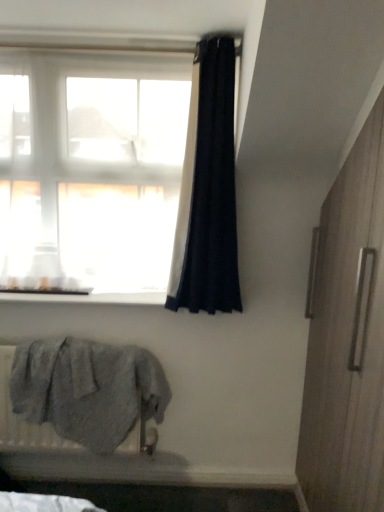
Where is `white smooth window sill at lower left`? white smooth window sill at lower left is located at coordinates (89, 298).

You are a GUI agent. You are given a task and a screenshot of the screen. Output one action in this format:
    pyautogui.click(x=<x>, y=<y>)
    Task: Click on the gray fluffy towel at lower left
    Image resolution: width=384 pixels, height=512 pixels.
    Given the screenshot: What is the action you would take?
    pyautogui.click(x=23, y=421)

I want to click on white smooth window sill at lower left, so click(x=89, y=298).

Is white smooth window sill at lower left situated inside gray fluffy towel at lower left or outside?

white smooth window sill at lower left is not inside gray fluffy towel at lower left, it's outside.

Considering the sizes of white smooth window sill at lower left and gray fluffy towel at lower left in the image, is white smooth window sill at lower left wider or thinner than gray fluffy towel at lower left?

In the image, white smooth window sill at lower left appears to be wider than gray fluffy towel at lower left.

Between white smooth window sill at lower left and gray fluffy towel at lower left, which one has more height?

gray fluffy towel at lower left is taller.

From the image's perspective, which one is positioned lower, gray fluffy towel at lower left or wooden screen door at right?

gray fluffy towel at lower left, from the image's perspective.

Considering the relative sizes of gray fluffy towel at lower left and wooden screen door at right in the image provided, is gray fluffy towel at lower left smaller than wooden screen door at right?

Yes.

Considering the points (126, 443) and (340, 463), which point is in front, point (126, 443) or point (340, 463)?

The point (340, 463) is closer to the camera.

Is white smooth window sill at lower left far away from black fabric curtain at upper center?

They are positioned close to each other.

How different are the orientations of white smooth window sill at lower left and black fabric curtain at upper center in degrees?

0.00253 degrees.

Where is `curtain in front of the white smooth window sill at lower left`? curtain in front of the white smooth window sill at lower left is located at coordinates (208, 190).

Does white smooth window sill at lower left have a greater width compared to black fabric curtain at upper center?

Correct, the width of white smooth window sill at lower left exceeds that of black fabric curtain at upper center.

Is translucent white curtain at upper left not inside wooden screen door at right?

Yes, translucent white curtain at upper left is located beyond the bounds of wooden screen door at right.

Considering the sizes of translucent white curtain at upper left and wooden screen door at right in the image, is translucent white curtain at upper left bigger or smaller than wooden screen door at right?

Considering their sizes, translucent white curtain at upper left takes up less space than wooden screen door at right.

From the image's perspective, between translucent white curtain at upper left and wooden screen door at right, which one is located above?

translucent white curtain at upper left, from the image's perspective.

Is the position of translucent white curtain at upper left less distant than that of wooden screen door at right?

No, translucent white curtain at upper left is further to the viewer.

The height and width of the screenshot is (512, 384). What are the coordinates of `radiator lying behind the translucent white curtain at upper left` in the screenshot? It's located at (23, 421).

Considering the relative sizes of gray fluffy towel at lower left and translucent white curtain at upper left in the image provided, is gray fluffy towel at lower left thinner than translucent white curtain at upper left?

Yes, gray fluffy towel at lower left is thinner than translucent white curtain at upper left.

Is gray fluffy towel at lower left taller or shorter than translucent white curtain at upper left?

Clearly, gray fluffy towel at lower left is shorter compared to translucent white curtain at upper left.

Considering the positions of objects gray fluffy towel at lower left and translucent white curtain at upper left in the image provided, who is more to the right, gray fluffy towel at lower left or translucent white curtain at upper left?

From the viewer's perspective, translucent white curtain at upper left appears more on the right side.

The image size is (384, 512). I want to click on curtain in front of the white smooth window sill at lower left, so click(208, 190).

Could you tell me if black fabric curtain at upper center is facing white smooth window sill at lower left?

No, black fabric curtain at upper center is not aimed at white smooth window sill at lower left.

Which object is positioned more to the left, black fabric curtain at upper center or white smooth window sill at lower left?

Positioned to the left is white smooth window sill at lower left.

Considering the positions of objects translucent white curtain at upper left and gray fluffy towel at lower left in the image provided, who is behind, translucent white curtain at upper left or gray fluffy towel at lower left?

gray fluffy towel at lower left is further away from the camera.

Can you tell me how much translucent white curtain at upper left and gray fluffy towel at lower left differ in facing direction?

There is a 0.0623-degree angle between the facing directions of translucent white curtain at upper left and gray fluffy towel at lower left.

Can you confirm if translucent white curtain at upper left is smaller than gray fluffy towel at lower left?

Actually, translucent white curtain at upper left might be larger than gray fluffy towel at lower left.

Does point (170, 185) appear closer or farther from the camera than point (43, 438)?

Point (170, 185) is positioned farther from the camera compared to point (43, 438).

In the image, there is a white smooth window sill at lower left. At what (x,y) coordinates should I click in order to perform the action: click on radiator below it (from a real-world perspective). Please return your answer as a coordinate pair (x, y). This screenshot has width=384, height=512. Looking at the image, I should click on (23, 421).

In the image, there is a gray fluffy towel at lower left. In order to click on screen door above it (from the image's perspective) in this screenshot , I will do `click(347, 339)`.

Considering their positions, is translucent white curtain at upper left positioned closer to wooden screen door at right than gray fluffy towel at lower left?

translucent white curtain at upper left lies closer to wooden screen door at right than the other object.

Based on the photo, considering their positions, is black fabric curtain at upper center positioned closer to white smooth window sill at lower left than wooden screen door at right?

The object closer to white smooth window sill at lower left is black fabric curtain at upper center.

From the image, which object appears to be nearer to white smooth window sill at lower left, translucent white curtain at upper left or black fabric curtain at upper center?

The object closer to white smooth window sill at lower left is translucent white curtain at upper left.

Based on their spatial positions, is black fabric curtain at upper center or white smooth window sill at lower left closer to gray fluffy towel at lower left?

Among the two, white smooth window sill at lower left is located nearer to gray fluffy towel at lower left.

Based on their spatial positions, is gray fluffy towel at lower left or translucent white curtain at upper left closer to wooden screen door at right?

translucent white curtain at upper left is positioned closer to the anchor wooden screen door at right.

When comparing their distances from wooden screen door at right, does white smooth window sill at lower left or translucent white curtain at upper left seem closer?

Among the two, white smooth window sill at lower left is located nearer to wooden screen door at right.

Looking at the image, which one is located closer to white smooth window sill at lower left, black fabric curtain at upper center or gray fluffy towel at lower left?

Among the two, black fabric curtain at upper center is located nearer to white smooth window sill at lower left.

Based on their spatial positions, is gray fluffy towel at lower left or wooden screen door at right closer to translucent white curtain at upper left?

Based on the image, gray fluffy towel at lower left appears to be nearer to translucent white curtain at upper left.

I want to click on window sill between translucent white curtain at upper left and gray fluffy towel at lower left vertically, so click(x=89, y=298).

Locate an element on the screen. This screenshot has width=384, height=512. window situated between gray fluffy towel at lower left and wooden screen door at right from left to right is located at coordinates (91, 172).

Identify the location of curtain positioned between wooden screen door at right and white smooth window sill at lower left from near to far. The height and width of the screenshot is (512, 384). (208, 190).

The height and width of the screenshot is (512, 384). Identify the location of window sill between black fabric curtain at upper center and gray fluffy towel at lower left vertically. (89, 298).